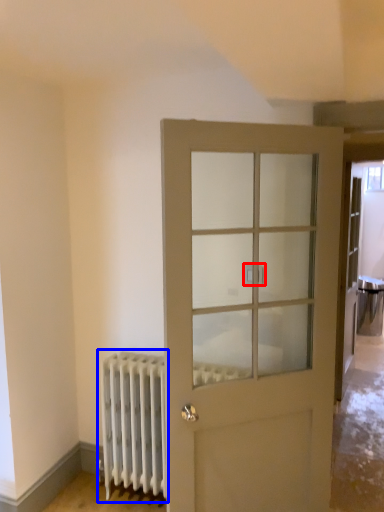
Question: Which point is further to the camera, door handle (highlighted by a red box) or radiator (highlighted by a blue box)?

Choices:
 (A) door handle
 (B) radiator

Answer: (B)